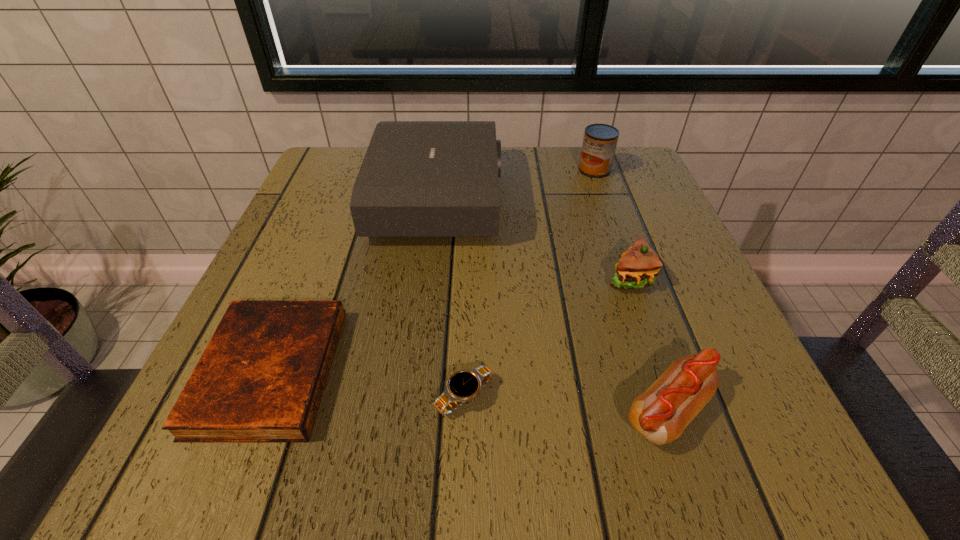
At what (x,y) coordinates should I click in order to perform the action: click on sausage located at the right edge. Please return your answer as a coordinate pair (x, y). This screenshot has width=960, height=540. Looking at the image, I should click on (660, 414).

Locate an element on the screen. object positioned at the near left corner is located at coordinates (261, 378).

At what (x,y) coordinates should I click in order to perform the action: click on object present at the far right corner. Please return your answer as a coordinate pair (x, y). Image resolution: width=960 pixels, height=540 pixels. Looking at the image, I should click on [600, 140].

Where is `object at the near right corner`? object at the near right corner is located at coordinates (660, 414).

Where is `free region at the far edge of the desktop`? The image size is (960, 540). free region at the far edge of the desktop is located at coordinates (531, 165).

Identify the location of blank area at the left edge. This screenshot has width=960, height=540. (301, 251).

Where is `vacant region at the right edge of the desktop`? This screenshot has height=540, width=960. vacant region at the right edge of the desktop is located at coordinates (634, 233).

What are the coordinates of `vacant space at the far left corner` in the screenshot? It's located at pyautogui.click(x=325, y=146).

This screenshot has height=540, width=960. I want to click on free space that is in between the can and the watch, so click(x=529, y=284).

Where is `free space that is in between the sandwich and the Bible`? free space that is in between the sandwich and the Bible is located at coordinates click(450, 325).